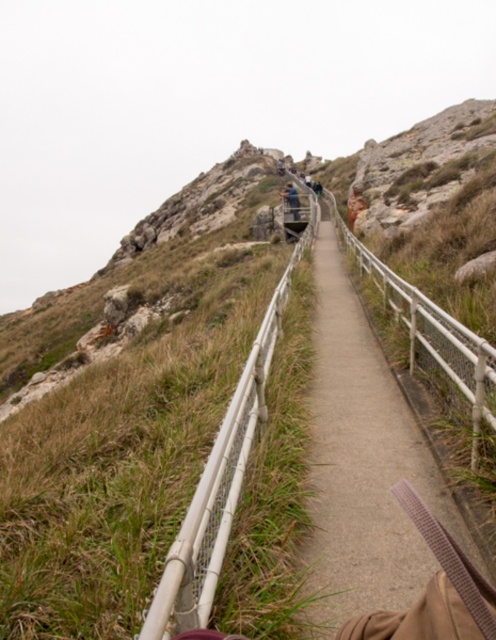
You are a hiker planning to walk along the path in the image. The trail has a point marked at coordinates (362, 464). What type of surface will you encounter at that specific point?

The point at coordinates (362, 464) marks a smooth concrete path at center, so you will encounter a smooth concrete surface there.

You are a hiker carrying a backpack and notice the smooth concrete path at center and dark blue jeans at center. Which object is smaller in size?

The smooth concrete path at center is smaller in size compared to the dark blue jeans at center according to the description.

You are a hiker wearing dark blue jeans at center and standing on the smooth concrete path at center. There is a steep drop to your left. Which direction should you move to stay safe?

You should move to the right towards the smooth concrete path at center since it is to the right of dark blue jeans at center and away from the steep drop on the left.